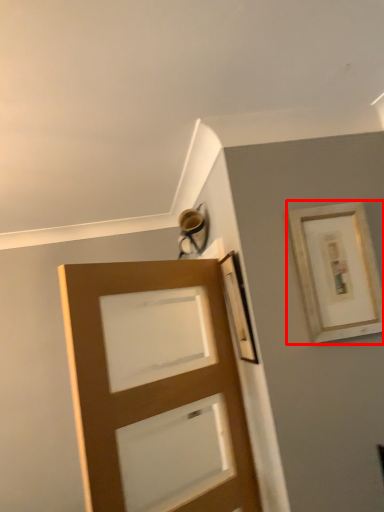
Question: From the image's perspective, where is picture frame (annotated by the red box) located relative to door?

Choices:
 (A) above
 (B) below

Answer: (A)